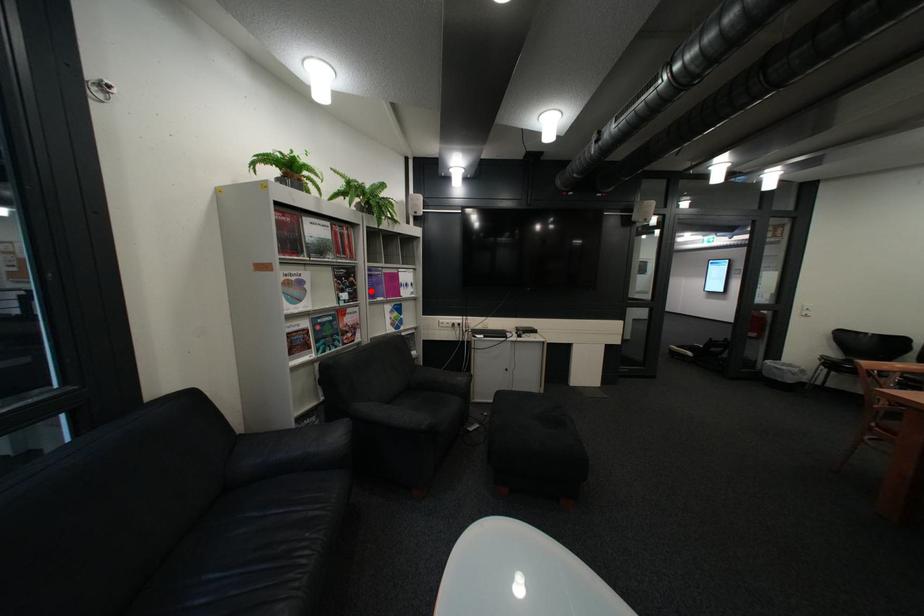
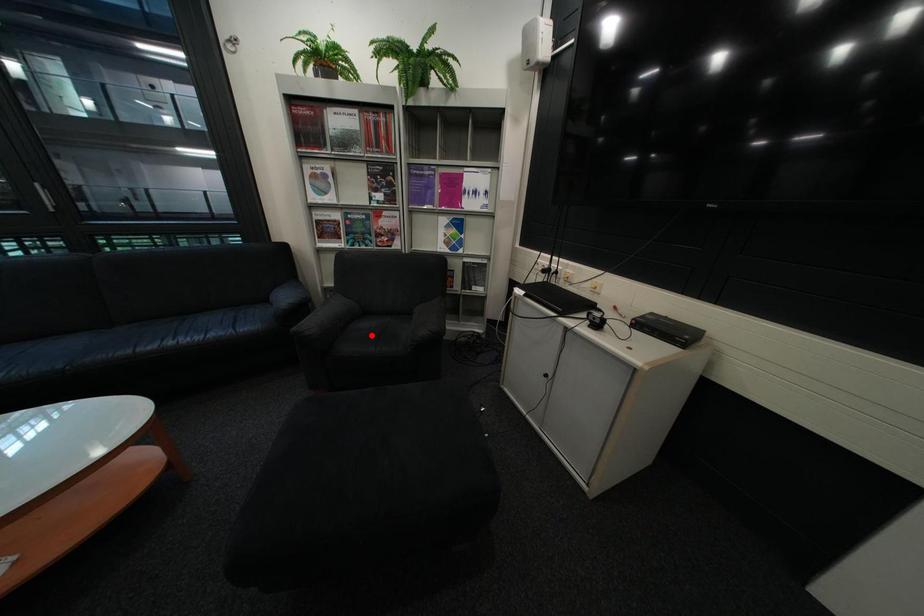
I am providing you with two images of the same scene from different viewpoints. A red point is marked on the first image and another point is marked on the second image. Does the point marked in image1 correspond to the same location as the one in image2?

No